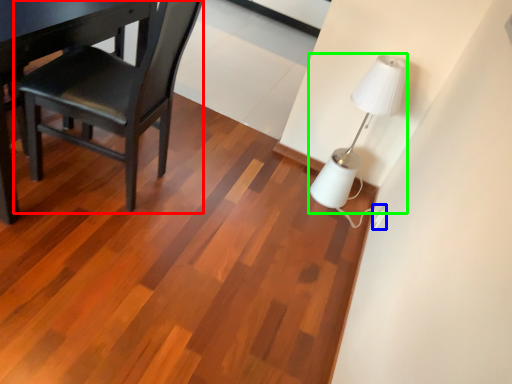
Question: Which object is the farthest from chair (highlighted by a red box)? Choose among these: electric outlet (highlighted by a blue box) or lamp (highlighted by a green box).

Choices:
 (A) electric outlet
 (B) lamp

Answer: (A)